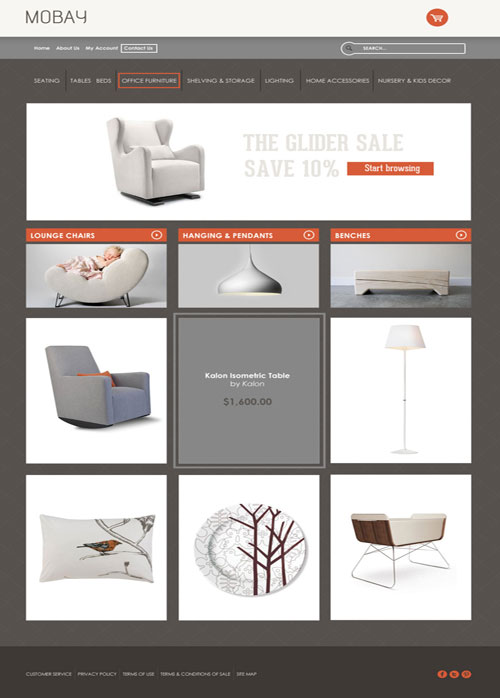
At what (x,y) coordinates should I click in order to perform the action: click on white lamp. Please return your answer as a coordinate pair (x, y). This screenshot has width=500, height=698. Looking at the image, I should click on (402, 392).